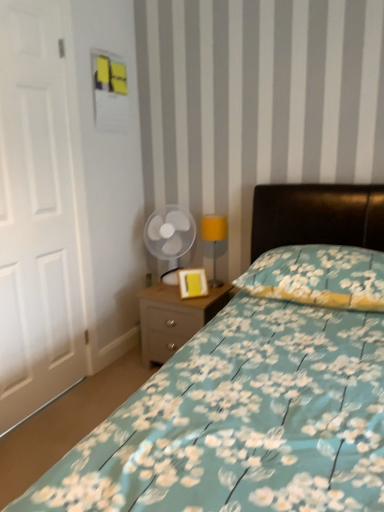
Question: Considering the relative positions of floral fabric bed at center and transparent plastic fan at center in the image provided, is floral fabric bed at center in front of transparent plastic fan at center?

Choices:
 (A) yes
 (B) no

Answer: (A)

Question: Can you confirm if floral fabric bed at center is positioned to the right of transparent plastic fan at center?

Choices:
 (A) no
 (B) yes

Answer: (B)

Question: Is floral fabric bed at center with transparent plastic fan at center?

Choices:
 (A) yes
 (B) no

Answer: (B)

Question: From the image's perspective, is floral fabric bed at center on top of transparent plastic fan at center?

Choices:
 (A) yes
 (B) no

Answer: (B)

Question: Is floral fabric bed at center wider than transparent plastic fan at center?

Choices:
 (A) no
 (B) yes

Answer: (B)

Question: Can you confirm if floral fabric bed at center is thinner than transparent plastic fan at center?

Choices:
 (A) yes
 (B) no

Answer: (B)

Question: Does floral fabric bed at center appear on the left side of white matte door at left?

Choices:
 (A) yes
 (B) no

Answer: (B)

Question: Does floral fabric bed at center come behind white matte door at left?

Choices:
 (A) no
 (B) yes

Answer: (A)

Question: Is floral fabric bed at center taller than white matte door at left?

Choices:
 (A) no
 (B) yes

Answer: (A)

Question: Considering the relative sizes of floral fabric bed at center and white matte door at left in the image provided, is floral fabric bed at center smaller than white matte door at left?

Choices:
 (A) yes
 (B) no

Answer: (B)

Question: Does floral fabric bed at center turn towards white matte door at left?

Choices:
 (A) no
 (B) yes

Answer: (A)

Question: Is floral fabric bed at center positioned with its back to white matte door at left?

Choices:
 (A) yes
 (B) no

Answer: (B)

Question: Are floral fabric bed at center and yellow matte picture frame at center located far from each other?

Choices:
 (A) yes
 (B) no

Answer: (B)